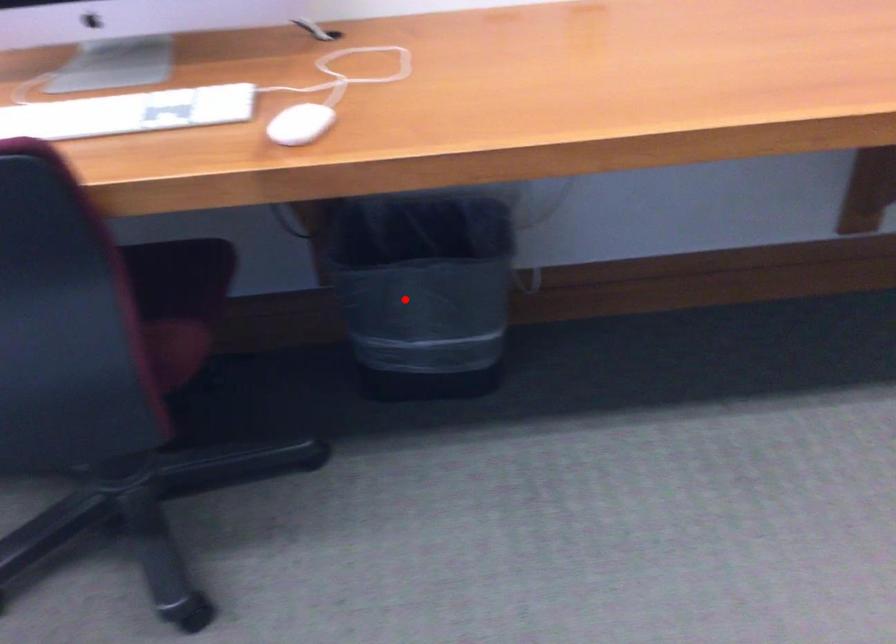
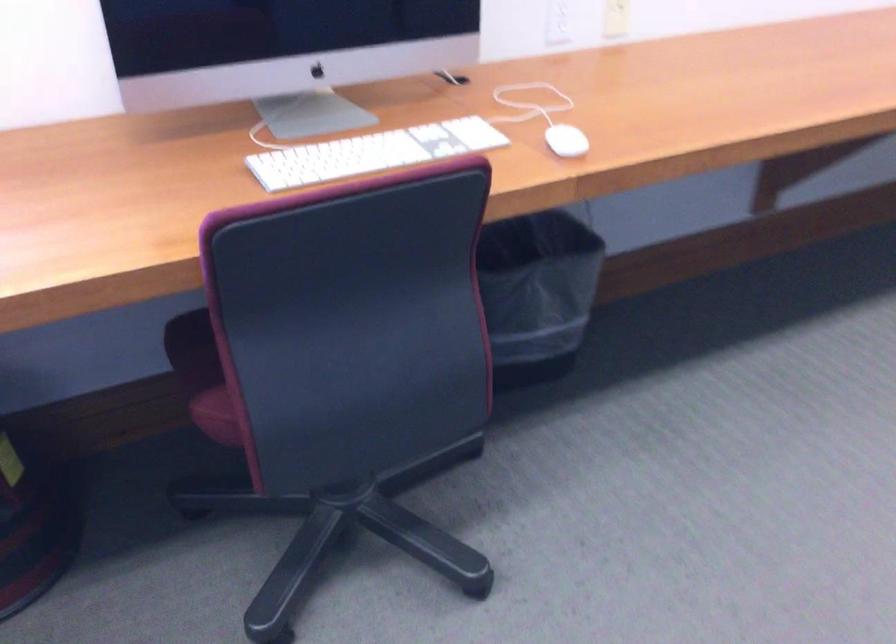
Question: I am providing you with two images of the same scene from different viewpoints. In image1, a red point is highlighted. Considering the same 3D point in image2, which of the following is correct?

Choices:
 (A) It is closer
 (B) It is farther

Answer: (B)